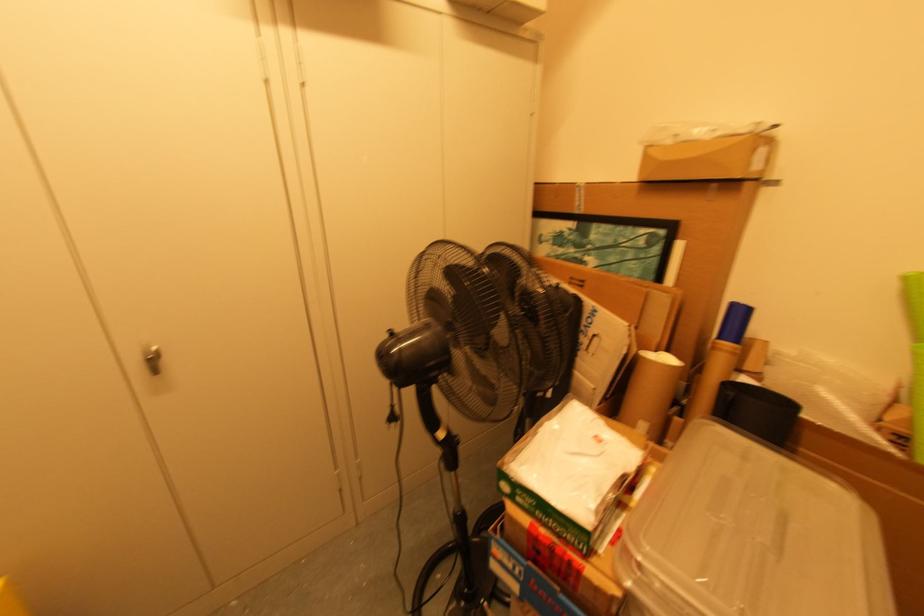
You are a GUI agent. You are given a task and a screenshot of the screen. Output one action in this format:
    pyautogui.click(x=<x>, y=<y>)
    Task: Click on the cardboard box
    This screenshot has height=616, width=924.
    Given the screenshot: What is the action you would take?
    pyautogui.click(x=575, y=517)